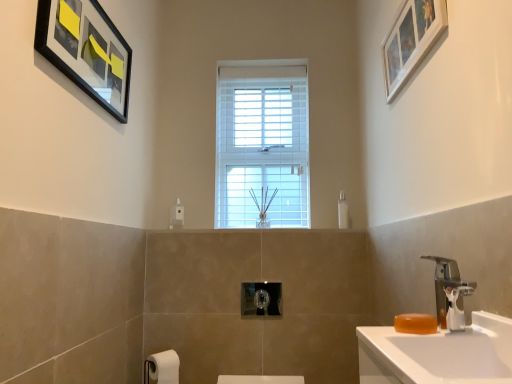
Question: Is silver metallic faucet at right situated inside white wooden picture frame at upper right, the 1th picture frame positioned from the right, or outside?

Choices:
 (A) inside
 (B) outside

Answer: (B)

Question: Considering the positions of silver metallic faucet at right and white wooden picture frame at upper right, marked as the second picture frame in a left-to-right arrangement, in the image, is silver metallic faucet at right wider or thinner than white wooden picture frame at upper right, marked as the second picture frame in a left-to-right arrangement,?

Choices:
 (A) thin
 (B) wide

Answer: (B)

Question: Which is farther from the black matte picture frame at upper left, marked as the 1th picture frame in a left-to-right arrangement?

Choices:
 (A) white wooden picture frame at upper right, marked as the second picture frame in a left-to-right arrangement
 (B) polished chrome towel bar at center
 (C) transparent plastic soap dispenser at center-right
 (D) silver metallic faucet at right
 (E) white matte toilet paper at lower left

Answer: (C)

Question: Based on their relative distances, which object is farther from the black matte picture frame at upper left, positioned as the second picture frame in right-to-left order?

Choices:
 (A) white wooden picture frame at upper right, the 1th picture frame positioned from the right
 (B) white matte toilet paper at lower left
 (C) polished chrome towel bar at center
 (D) transparent plastic soap dispenser at center-right
 (E) white glossy sink at right

Answer: (D)